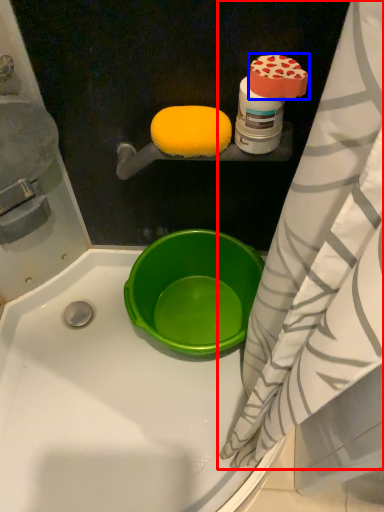
Question: Among these objects, which one is nearest to the camera, curtain (highlighted by a red box) or food (highlighted by a blue box)?

Choices:
 (A) curtain
 (B) food

Answer: (A)